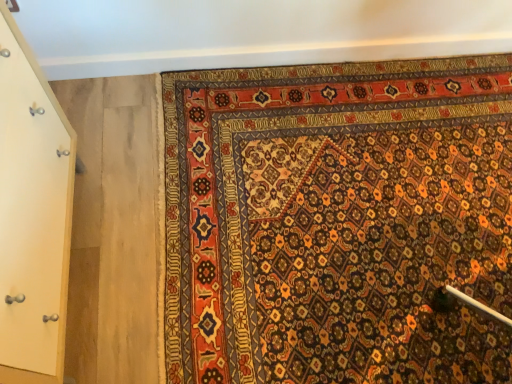
The image size is (512, 384). What are the coordinates of `vacant space behind light wood door at left` in the screenshot? It's located at tap(112, 146).